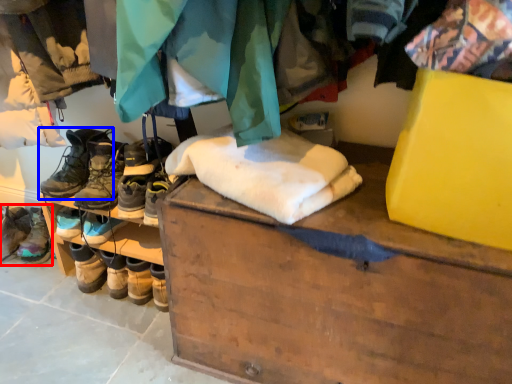
Question: Which object appears closest to the camera in this image, footwear (highlighted by a red box) or footwear (highlighted by a blue box)?

Choices:
 (A) footwear
 (B) footwear

Answer: (B)